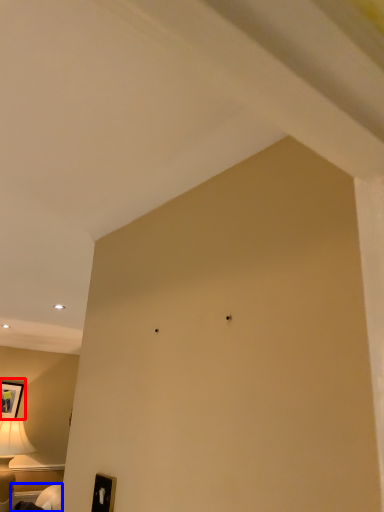
Question: Among these objects, which one is farthest to the camera, picture frame (highlighted by a red box) or furniture (highlighted by a blue box)?

Choices:
 (A) picture frame
 (B) furniture

Answer: (A)